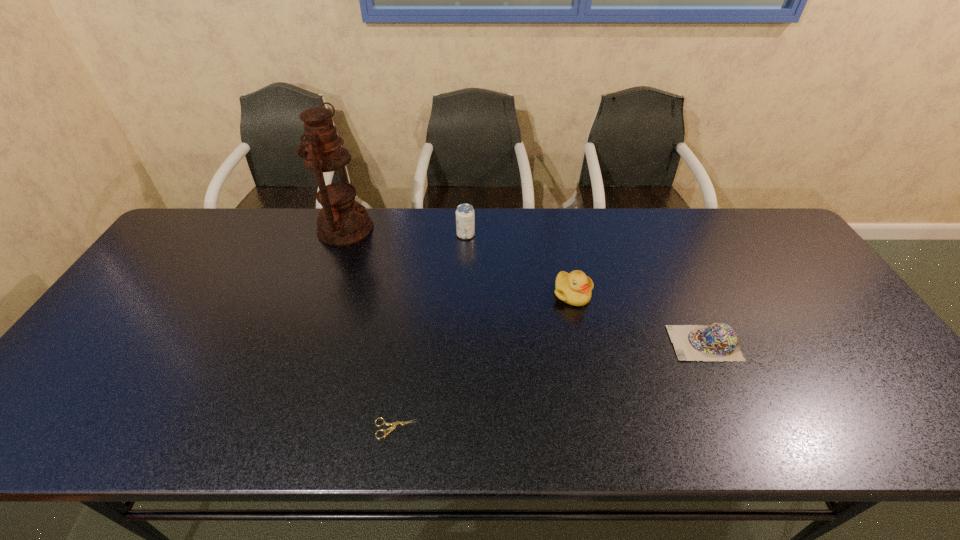
Where is `vacant region between the third object from right to left and the third nearest object`? Image resolution: width=960 pixels, height=540 pixels. vacant region between the third object from right to left and the third nearest object is located at coordinates (519, 265).

Where is `free point between the fourth object from right to left and the rightmost object`? This screenshot has height=540, width=960. free point between the fourth object from right to left and the rightmost object is located at coordinates (550, 386).

The image size is (960, 540). I want to click on vacant area that lies between the second object from right to left and the soda can, so click(519, 265).

I want to click on vacant space that is in between the fourth object from left to right and the soda can, so click(519, 265).

I want to click on free area in between the nearest object and the oil lamp, so click(x=371, y=329).

What are the coordinates of `the closest object relative to the cap` in the screenshot? It's located at (574, 288).

The image size is (960, 540). Find the location of `object that stands as the third closest to the leftmost object`. object that stands as the third closest to the leftmost object is located at coordinates (394, 424).